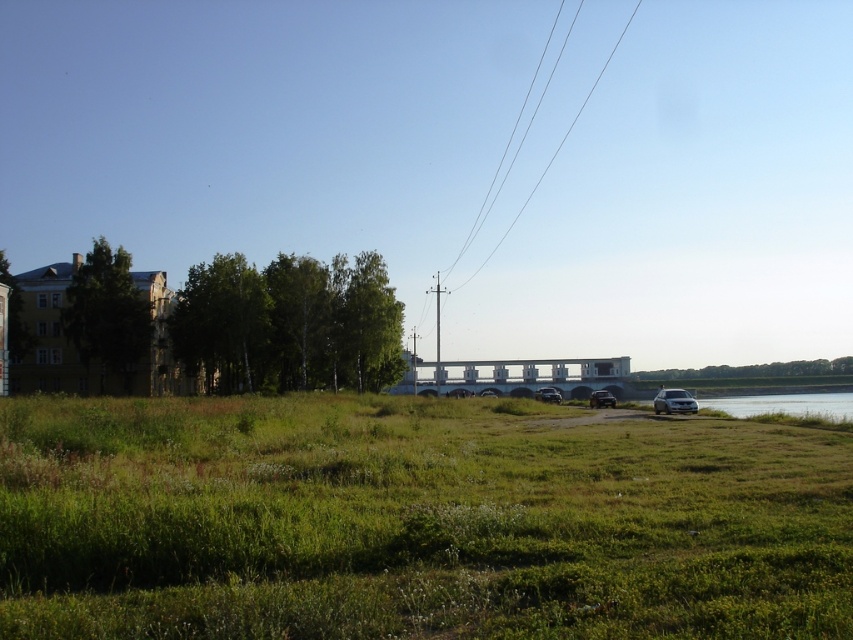
Question: Which of these objects is positioned farthest from the white concrete bridge at center?

Choices:
 (A) clear wire at upper center
 (B) silver metallic car at center
 (C) satin silver suv at lower right
 (D) green grassy field at lower center

Answer: (A)

Question: From the image, what is the correct spatial relationship of green grassy field at lower center in relation to satin silver suv at lower right?

Choices:
 (A) right
 (B) left

Answer: (B)

Question: Which of the following is the closest to the observer?

Choices:
 (A) (544, 166)
 (B) (595, 406)
 (C) (691, 403)

Answer: (C)

Question: Does green grassy field at lower center have a larger size compared to silver metallic car at center?

Choices:
 (A) no
 (B) yes

Answer: (B)

Question: Which object is positioned farthest from the clear wire at upper center?

Choices:
 (A) silver metallic car at center
 (B) green grassy field at lower center
 (C) white concrete bridge at center

Answer: (B)

Question: Is green grassy field at lower center thinner than silver metallic car at center?

Choices:
 (A) yes
 (B) no

Answer: (B)